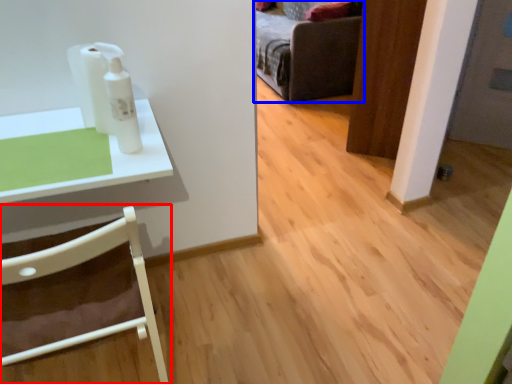
Question: Among these objects, which one is farthest to the camera, chair (highlighted by a red box) or furniture (highlighted by a blue box)?

Choices:
 (A) chair
 (B) furniture

Answer: (B)